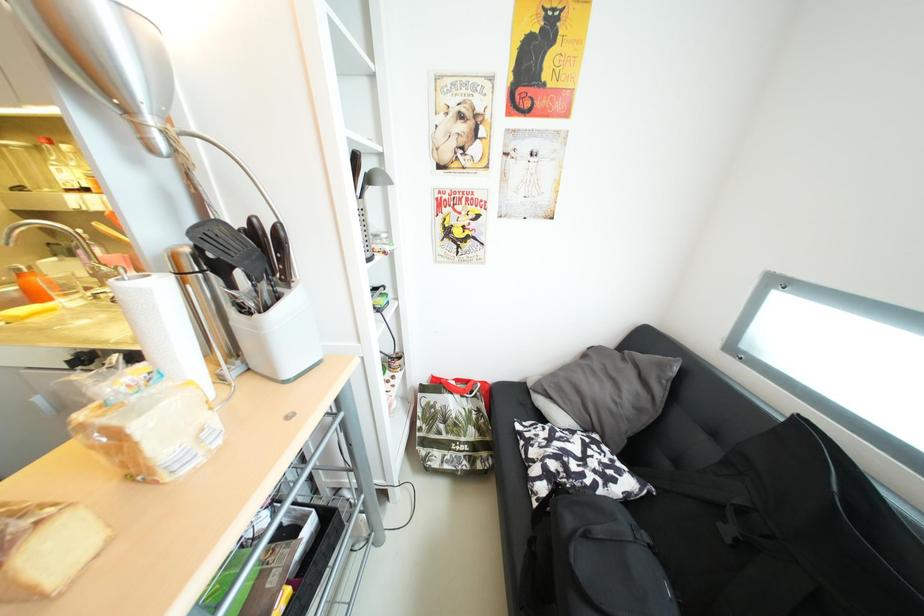
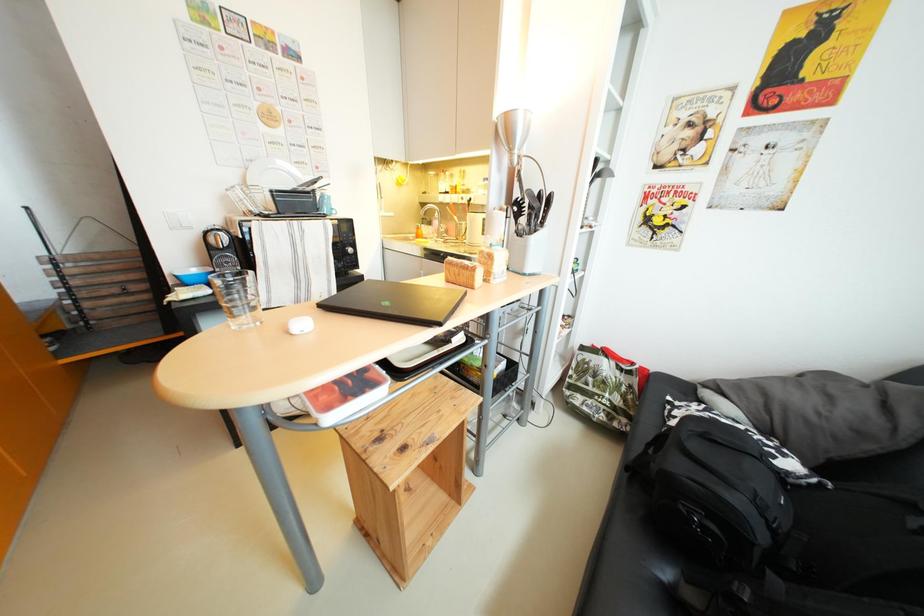
Question: The camera is either moving clockwise (left) or counter-clockwise (right) around the object. The first image is from the beginning of the video and the second image is from the end. Is the camera moving left or right when shooting the video?

Choices:
 (A) Left
 (B) Right

Answer: (B)